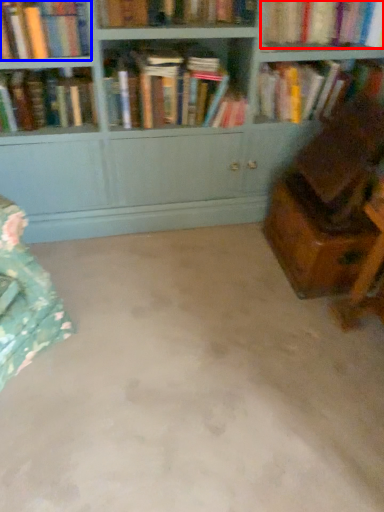
Question: Among these objects, which one is farthest to the camera, book (highlighted by a red box) or book (highlighted by a blue box)?

Choices:
 (A) book
 (B) book

Answer: (A)